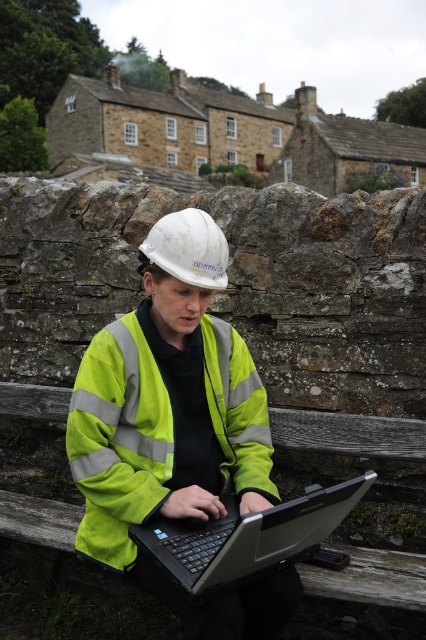
Is neon yellow reflective vest at center bigger than black plastic laptop at center?

Yes.

Between neon yellow reflective vest at center and black plastic laptop at center, which one appears on the right side from the viewer's perspective?

Positioned to the right is black plastic laptop at center.

The width and height of the screenshot is (426, 640). What are the coordinates of `neon yellow reflective vest at center` in the screenshot? It's located at point(175,428).

At what (x,y) coordinates should I click in order to perform the action: click on neon yellow reflective vest at center. Please return your answer as a coordinate pair (x, y). Looking at the image, I should click on (175, 428).